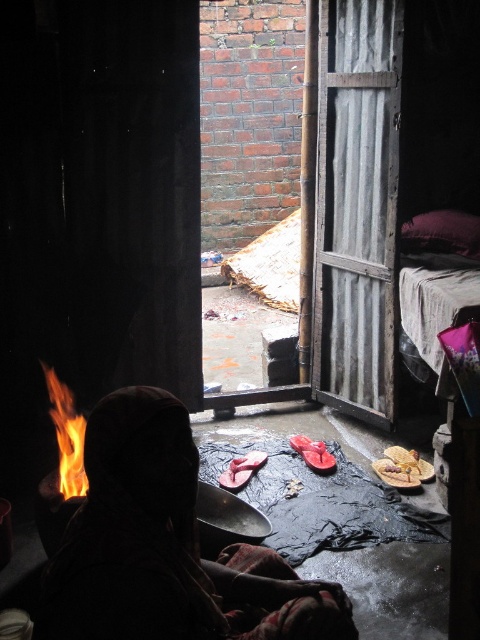
Question: Is silhouette fabric at center closer to camera compared to flameflame at center?

Choices:
 (A) yes
 (B) no

Answer: (A)

Question: Which point appears closest to the camera in this image?

Choices:
 (A) (60, 486)
 (B) (324, 580)

Answer: (B)

Question: Where is silhouette fabric at center located in relation to flameflame at center in the image?

Choices:
 (A) below
 (B) above

Answer: (A)

Question: Can you confirm if silhouette fabric at center is smaller than flameflame at center?

Choices:
 (A) yes
 (B) no

Answer: (B)

Question: Among these points, which one is farthest from the camera?

Choices:
 (A) (71, 480)
 (B) (119, 397)

Answer: (A)